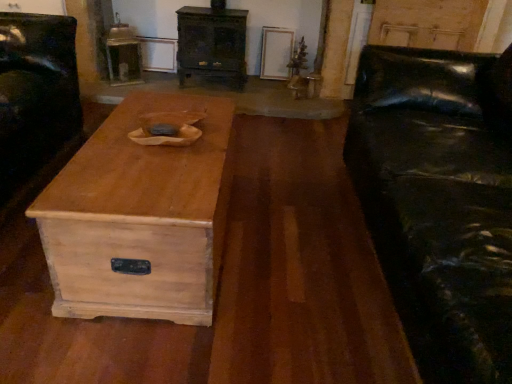
Question: Is black leather couch at right looking in the opposite direction of wooden chest of drawers at center?

Choices:
 (A) no
 (B) yes

Answer: (A)

Question: Is black leather couch at right wider than wooden chest of drawers at center?

Choices:
 (A) yes
 (B) no

Answer: (A)

Question: Is black leather couch at right aimed at wooden chest of drawers at center?

Choices:
 (A) yes
 (B) no

Answer: (B)

Question: From a real-world perspective, does black leather couch at right sit lower than wooden chest of drawers at center?

Choices:
 (A) no
 (B) yes

Answer: (A)

Question: Is black leather couch at right positioned behind wooden chest of drawers at center?

Choices:
 (A) no
 (B) yes

Answer: (A)

Question: Does point [4, 102] appear closer or farther from the camera than point [238, 28]?

Choices:
 (A) closer
 (B) farther

Answer: (A)

Question: From their relative heights in the image, would you say black leather armchair at left is taller or shorter than wooden chest of drawers at center?

Choices:
 (A) short
 (B) tall

Answer: (B)

Question: Which is correct: black leather armchair at left is inside wooden chest of drawers at center, or outside of it?

Choices:
 (A) inside
 (B) outside

Answer: (B)

Question: From a real-world perspective, is black leather armchair at left above or below wooden chest of drawers at center?

Choices:
 (A) below
 (B) above

Answer: (A)

Question: From their relative heights in the image, would you say light brown wood coffee table at center is taller or shorter than black leather armchair at left?

Choices:
 (A) tall
 (B) short

Answer: (B)

Question: Considering their positions, is light brown wood coffee table at center located in front of or behind black leather armchair at left?

Choices:
 (A) front
 (B) behind

Answer: (A)

Question: In the image, is light brown wood coffee table at center on the left side or the right side of black leather armchair at left?

Choices:
 (A) right
 (B) left

Answer: (A)

Question: From the image's perspective, is light brown wood coffee table at center located above or below black leather armchair at left?

Choices:
 (A) below
 (B) above

Answer: (A)

Question: In terms of size, does black leather couch at right appear bigger or smaller than black leather armchair at left?

Choices:
 (A) small
 (B) big

Answer: (B)

Question: In terms of height, does black leather couch at right look taller or shorter compared to black leather armchair at left?

Choices:
 (A) tall
 (B) short

Answer: (A)